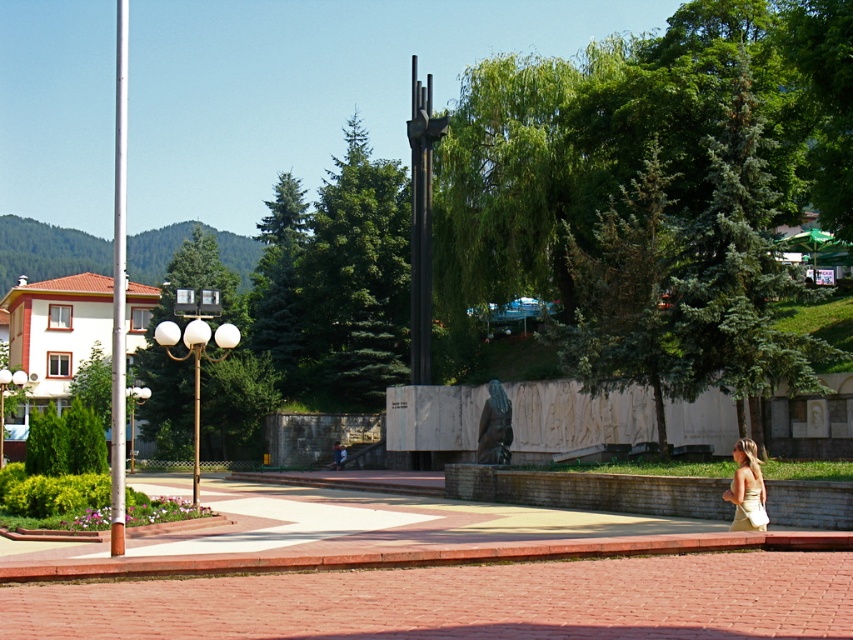
Question: Is polished silver pole at left to the right of light beige dress at lower right from the viewer's perspective?

Choices:
 (A) no
 (B) yes

Answer: (A)

Question: Which point is closer to the camera taking this photo?

Choices:
 (A) (117, 464)
 (B) (753, 506)
 (C) (749, 476)

Answer: (A)

Question: Observing the image, what is the correct spatial positioning of light beige dress at lower right in reference to beige satin dress at lower right?

Choices:
 (A) below
 (B) above

Answer: (A)

Question: Estimate the real-world distances between objects in this image. Which object is closer to the light beige dress at lower right?

Choices:
 (A) polished silver pole at left
 (B) beige satin dress at lower right

Answer: (B)

Question: Which of the following is the closest to the observer?

Choices:
 (A) (756, 509)
 (B) (114, 545)

Answer: (B)

Question: Is light beige dress at lower right below beige satin dress at lower right?

Choices:
 (A) yes
 (B) no

Answer: (A)